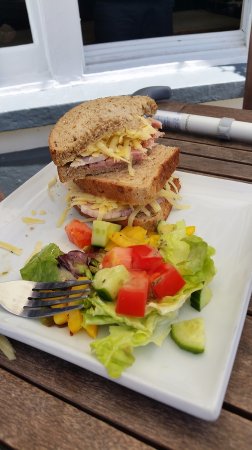
Locate an element on the screen. fork is located at coordinates (28, 293).